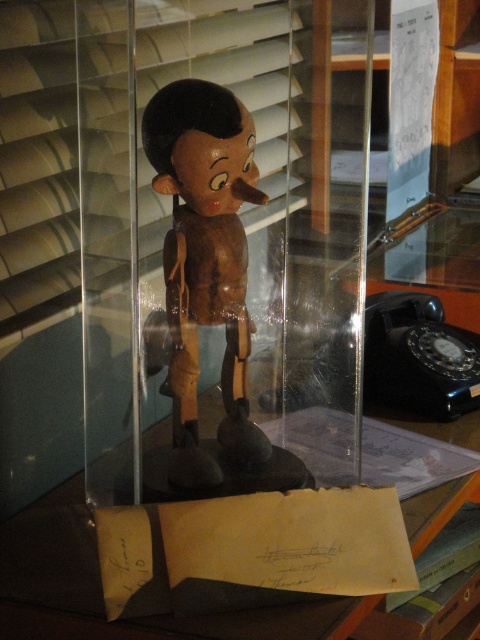
Question: Can you confirm if wooden figurine at center is thinner than transparent plastic table at center?

Choices:
 (A) yes
 (B) no

Answer: (A)

Question: Among these objects, which one is farthest from the camera?

Choices:
 (A) wooden figurine at center
 (B) transparent plastic table at center

Answer: (A)

Question: Is wooden figurine at center smaller than transparent plastic table at center?

Choices:
 (A) yes
 (B) no

Answer: (A)

Question: Among these objects, which one is farthest from the camera?

Choices:
 (A) transparent plastic table at center
 (B) wooden figurine at center

Answer: (B)

Question: Is wooden figurine at center below transparent plastic table at center?

Choices:
 (A) yes
 (B) no

Answer: (B)